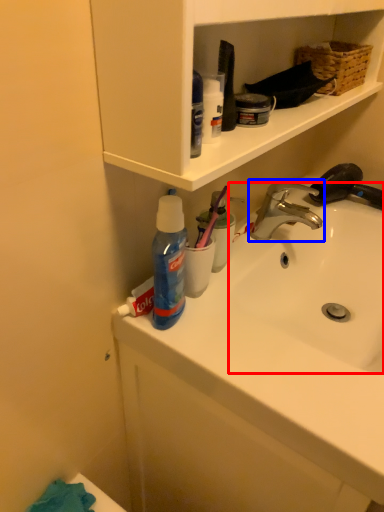
Question: Which point is closer to the camera, sink (highlighted by a red box) or tap (highlighted by a blue box)?

Choices:
 (A) sink
 (B) tap

Answer: (A)